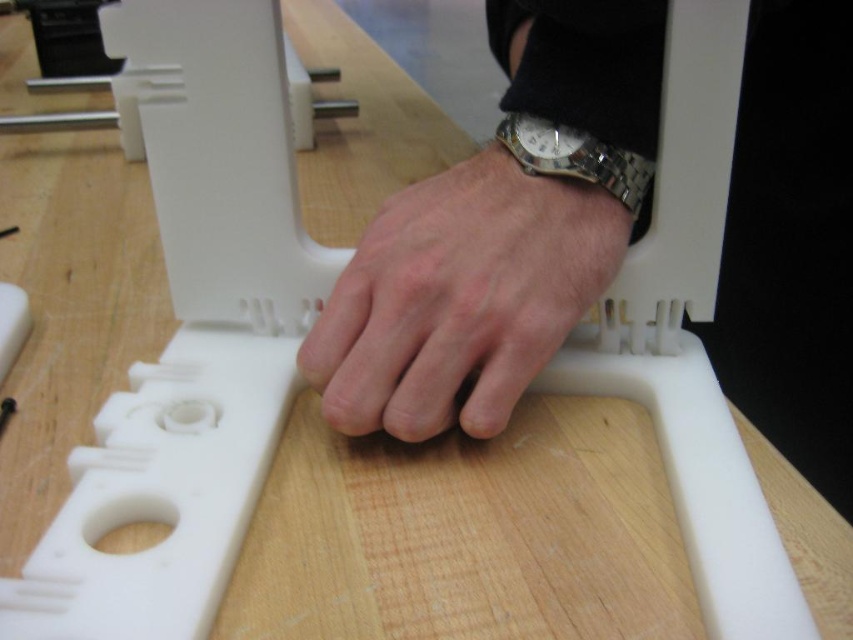
You are a technician working on a white plastic component. You notice a point marked at coordinates (460, 298). What object is located at that point?

The point at coordinates (460, 298) indicates the location of the skinny silver watch at center.